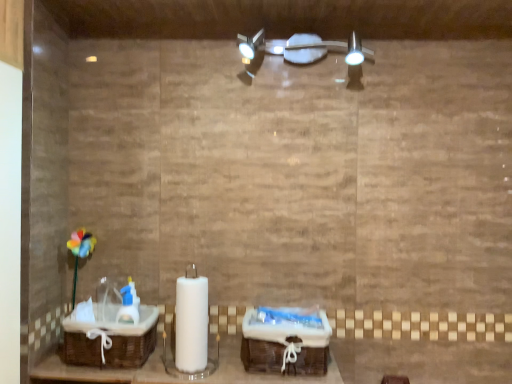
Question: Can you confirm if woven brown baskets at center is bigger than satin nickel light fixture at upper center?

Choices:
 (A) yes
 (B) no

Answer: (B)

Question: From the image's perspective, would you say woven brown baskets at center is positioned over satin nickel light fixture at upper center?

Choices:
 (A) yes
 (B) no

Answer: (B)

Question: Is woven brown baskets at center positioned behind satin nickel light fixture at upper center?

Choices:
 (A) yes
 (B) no

Answer: (B)

Question: Can you confirm if woven brown baskets at center is shorter than satin nickel light fixture at upper center?

Choices:
 (A) no
 (B) yes

Answer: (B)

Question: Considering the relative sizes of woven brown baskets at center and satin nickel light fixture at upper center in the image provided, is woven brown baskets at center taller than satin nickel light fixture at upper center?

Choices:
 (A) yes
 (B) no

Answer: (B)

Question: Is woven brown baskets at center surrounding satin nickel light fixture at upper center?

Choices:
 (A) no
 (B) yes

Answer: (A)

Question: Can you confirm if brown woven basket at lower left is smaller than woven brown baskets at center?

Choices:
 (A) yes
 (B) no

Answer: (B)

Question: Considering the relative positions of brown woven basket at lower left and woven brown baskets at center in the image provided, is brown woven basket at lower left behind woven brown baskets at center?

Choices:
 (A) yes
 (B) no

Answer: (A)

Question: Can you see brown woven basket at lower left touching woven brown baskets at center?

Choices:
 (A) yes
 (B) no

Answer: (B)

Question: From the image's perspective, is brown woven basket at lower left located beneath woven brown baskets at center?

Choices:
 (A) no
 (B) yes

Answer: (A)

Question: Is brown woven basket at lower left positioned in front of woven brown baskets at center?

Choices:
 (A) yes
 (B) no

Answer: (B)

Question: Does brown woven basket at lower left have a lesser height compared to woven brown baskets at center?

Choices:
 (A) no
 (B) yes

Answer: (A)

Question: Is brown woven basket at lower left not within satin nickel light fixture at upper center?

Choices:
 (A) no
 (B) yes

Answer: (B)